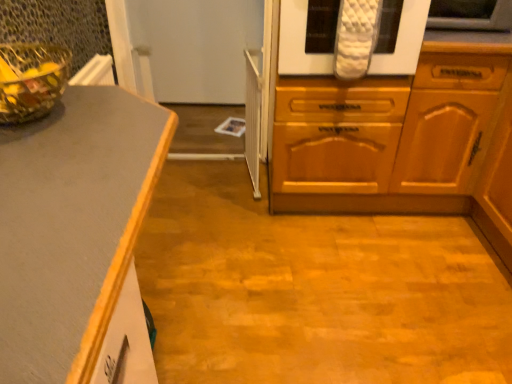
Question: Can we say white quilted oven mitts at upper center lies outside white quilted oven mitt at upper right?

Choices:
 (A) no
 (B) yes

Answer: (B)

Question: Does white quilted oven mitts at upper center appear on the left side of white quilted oven mitt at upper right?

Choices:
 (A) yes
 (B) no

Answer: (A)

Question: From a real-world perspective, is white quilted oven mitts at upper center located beneath white quilted oven mitt at upper right?

Choices:
 (A) yes
 (B) no

Answer: (A)

Question: Is white quilted oven mitts at upper center far away from white quilted oven mitt at upper right?

Choices:
 (A) yes
 (B) no

Answer: (B)

Question: From the image's perspective, does white quilted oven mitts at upper center appear higher than white quilted oven mitt at upper right?

Choices:
 (A) no
 (B) yes

Answer: (A)

Question: Looking at the image, does white quilted oven mitt at upper right seem bigger or smaller compared to white quilted oven mitts at upper center?

Choices:
 (A) big
 (B) small

Answer: (B)

Question: From the image's perspective, is white quilted oven mitt at upper right above or below white quilted oven mitts at upper center?

Choices:
 (A) above
 (B) below

Answer: (A)

Question: In the image, is white quilted oven mitt at upper right positioned in front of or behind white quilted oven mitts at upper center?

Choices:
 (A) front
 (B) behind

Answer: (B)

Question: Would you say white quilted oven mitt at upper right is to the left or to the right of white quilted oven mitts at upper center in the picture?

Choices:
 (A) right
 (B) left

Answer: (A)

Question: Is wooden cabinet at center taller or shorter than transparent glass bowl at upper left?

Choices:
 (A) short
 (B) tall

Answer: (B)

Question: From a real-world perspective, is wooden cabinet at center positioned above or below transparent glass bowl at upper left?

Choices:
 (A) below
 (B) above

Answer: (A)

Question: Is wooden cabinet at center bigger or smaller than transparent glass bowl at upper left?

Choices:
 (A) small
 (B) big

Answer: (B)

Question: Considering their positions, is wooden cabinet at center located in front of or behind transparent glass bowl at upper left?

Choices:
 (A) behind
 (B) front

Answer: (A)

Question: From a real-world perspective, is white quilted oven mitts at upper center above or below wooden cabinet at center?

Choices:
 (A) below
 (B) above

Answer: (B)

Question: Considering the relative positions of white quilted oven mitts at upper center and wooden cabinet at center in the image provided, is white quilted oven mitts at upper center to the left or to the right of wooden cabinet at center?

Choices:
 (A) right
 (B) left

Answer: (A)